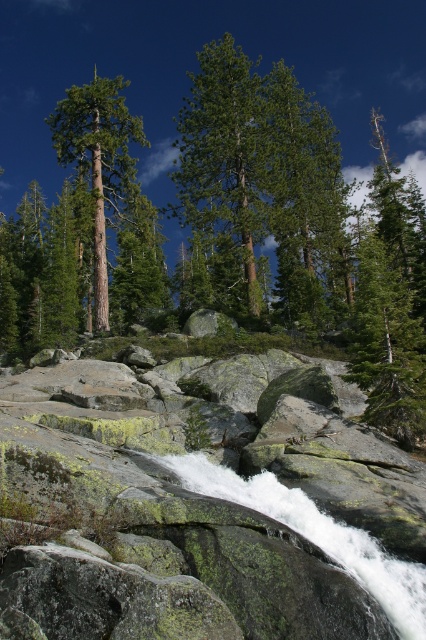
You are a hiker standing at the base of the green mossy rock at center and want to reach the green matte tree at left. Which direction should you move to get closer to the tree?

The green mossy rock at center is in front of the green matte tree at left, so you should move backward away from the rock to get closer to the tree.

You are a hiker trying to cross the rocky terrain. You have to choose between stepping on the green mossy rock at center and the green matte tree at left. Which object is narrower and safer to step on?

The green mossy rock at center is thinner than the green matte tree at left, so stepping on the green mossy rock at center would be narrower and safer.